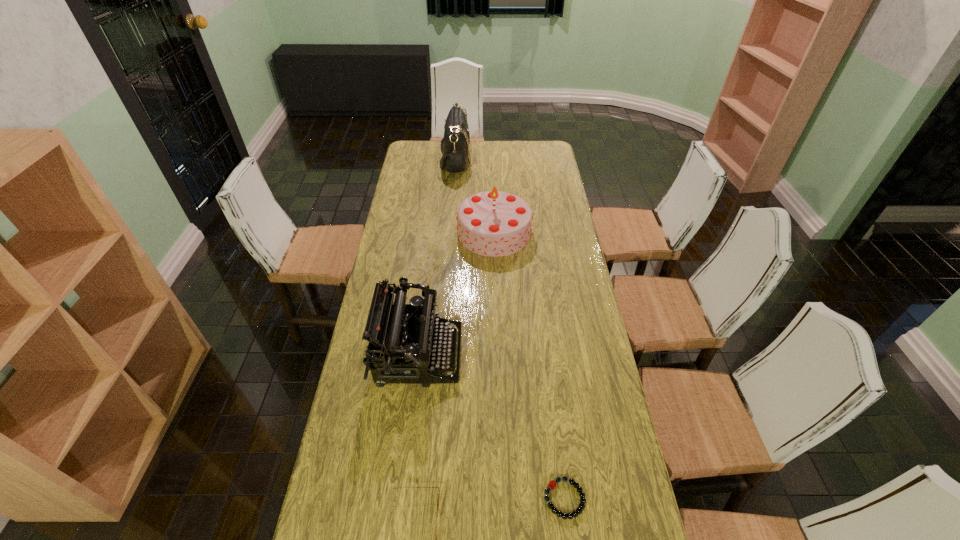
You are a GUI agent. You are given a task and a screenshot of the screen. Output one action in this format:
    pyautogui.click(x=<x>, y=<y>)
    Task: Click on the free spot between the shortest object and the farthest object
    
    Given the screenshot: What is the action you would take?
    pyautogui.click(x=510, y=329)

This screenshot has height=540, width=960. What are the coordinates of `object that stands as the third closest to the second farthest object` in the screenshot? It's located at tap(552, 484).

This screenshot has width=960, height=540. I want to click on object that is the third closest one to the fourth tallest object, so click(493, 223).

Where is `free spot that satisfies the following two spatial constraints: 1. at the front of the farthest object with chain and zipper; 2. on the back side of the second farthest object`? free spot that satisfies the following two spatial constraints: 1. at the front of the farthest object with chain and zipper; 2. on the back side of the second farthest object is located at coordinates pos(450,232).

Where is `vacant area in the image that satisfies the following two spatial constraints: 1. at the front of the shortest object with chain and zipper; 2. on the left side of the handbag`? vacant area in the image that satisfies the following two spatial constraints: 1. at the front of the shortest object with chain and zipper; 2. on the left side of the handbag is located at coordinates (430, 498).

Where is `blank area in the image that satisfies the following two spatial constraints: 1. at the front of the handbag with chain and zipper; 2. on the right side of the shortest object`? blank area in the image that satisfies the following two spatial constraints: 1. at the front of the handbag with chain and zipper; 2. on the right side of the shortest object is located at coordinates (430, 498).

The image size is (960, 540). Identify the location of blank space that satisfies the following two spatial constraints: 1. at the front of the bracelet with chain and zipper; 2. on the left side of the farthest object. (430, 498).

This screenshot has height=540, width=960. In order to click on vacant space that satisfies the following two spatial constraints: 1. at the front of the birthday cake with chain and zipper; 2. on the right side of the handbag in this screenshot , I will do `click(450, 232)`.

Where is `vacant space that satisfies the following two spatial constraints: 1. at the front of the bracelet with chain and zipper; 2. on the left side of the farthest object`? vacant space that satisfies the following two spatial constraints: 1. at the front of the bracelet with chain and zipper; 2. on the left side of the farthest object is located at coordinates (430, 498).